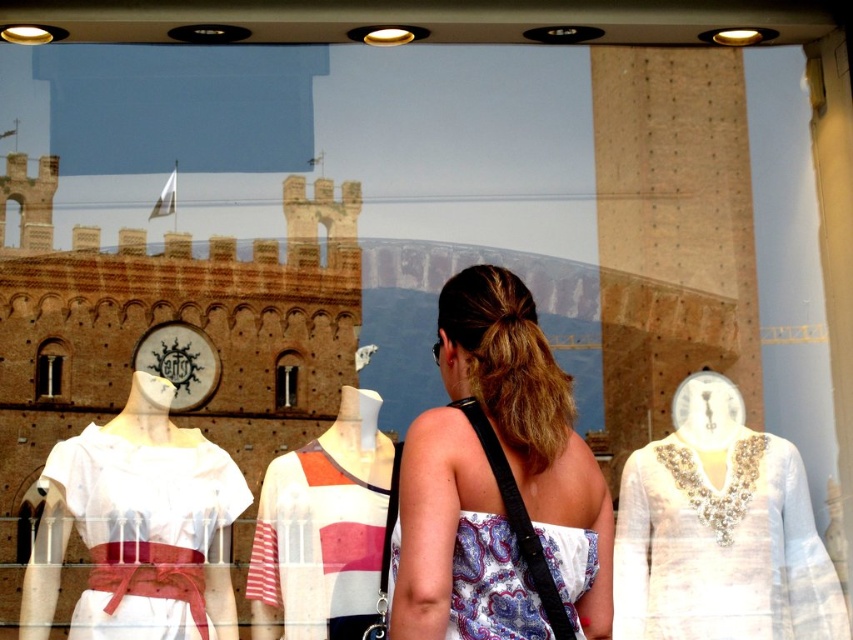
Question: Which point is farther from the camera taking this photo?

Choices:
 (A) (38, 372)
 (B) (195, 493)
 (C) (41, 353)

Answer: (A)

Question: Is smooth stone arch at center wider than matte glass window at center?

Choices:
 (A) yes
 (B) no

Answer: (A)

Question: Is white sheer dress at center smaller than white fabric dress at center?

Choices:
 (A) no
 (B) yes

Answer: (A)

Question: Which is nearer to the smooth stone arch at center?

Choices:
 (A) striped cotton dress at center
 (B) matte glass window at center

Answer: (B)

Question: Where is white sheer dress at center located in relation to white fabric dress at center in the image?

Choices:
 (A) below
 (B) above

Answer: (A)

Question: Among these points, which one is nearest to the camera?

Choices:
 (A) (283, 362)
 (B) (578, 621)

Answer: (B)